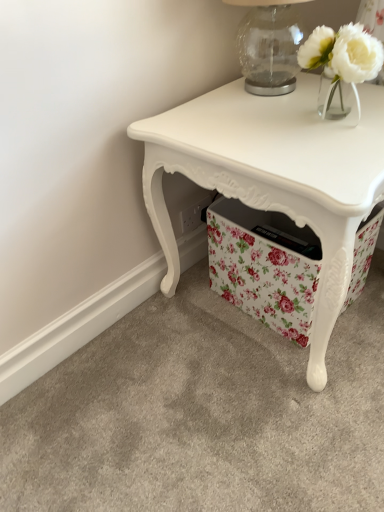
Identify the location of vacant area that lies in front of white glass vase at upper right. (338, 146).